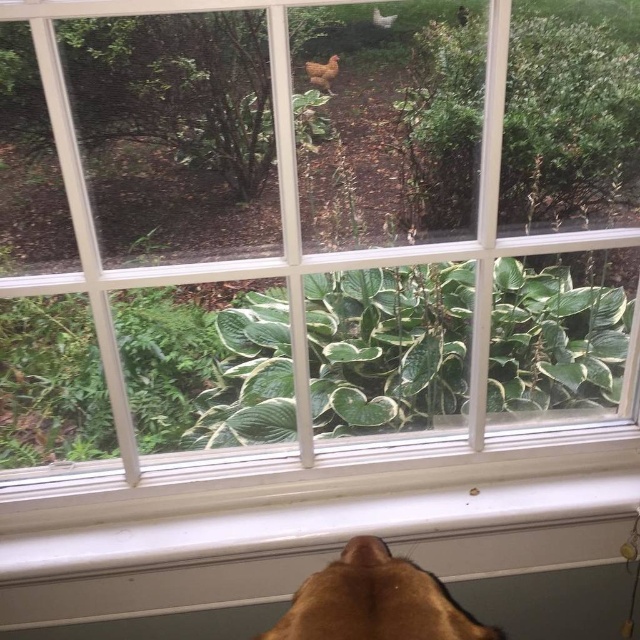
Who is positioned more to the right, green leafy plant at center or green leafy plant at upper center?

green leafy plant at upper center

Is green leafy plant at center thinner than green leafy plant at upper center?

In fact, green leafy plant at center might be wider than green leafy plant at upper center.

The width and height of the screenshot is (640, 640). What are the coordinates of `green leafy plant at center` in the screenshot? It's located at tap(205, 365).

Can you confirm if green leafy plant at center is positioned below brown furry dog at bottom?

No, green leafy plant at center is not below brown furry dog at bottom.

Which is in front, point (196, 364) or point (472, 627)?

Positioned in front is point (472, 627).

The width and height of the screenshot is (640, 640). I want to click on green leafy plant at center, so click(205, 365).

Is green leafy plant at upper center in front of brown furry dog at bottom?

No, green leafy plant at upper center is behind brown furry dog at bottom.

Between green leafy plant at upper center and brown furry dog at bottom, which one appears on the right side from the viewer's perspective?

green leafy plant at upper center

Who is more distant from viewer, (616, 60) or (330, 595)?

Positioned behind is point (616, 60).

Identify the location of green leafy plant at upper center. (566, 122).